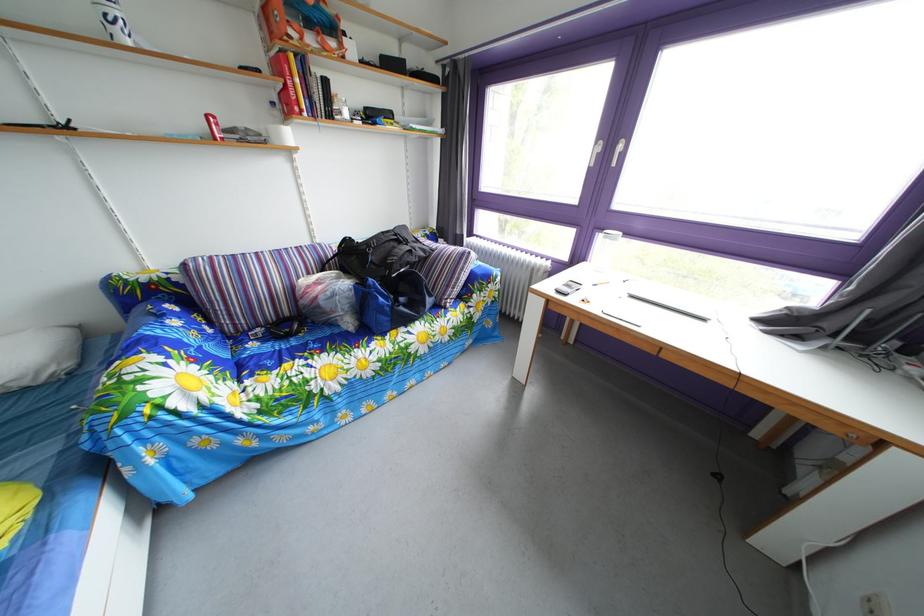
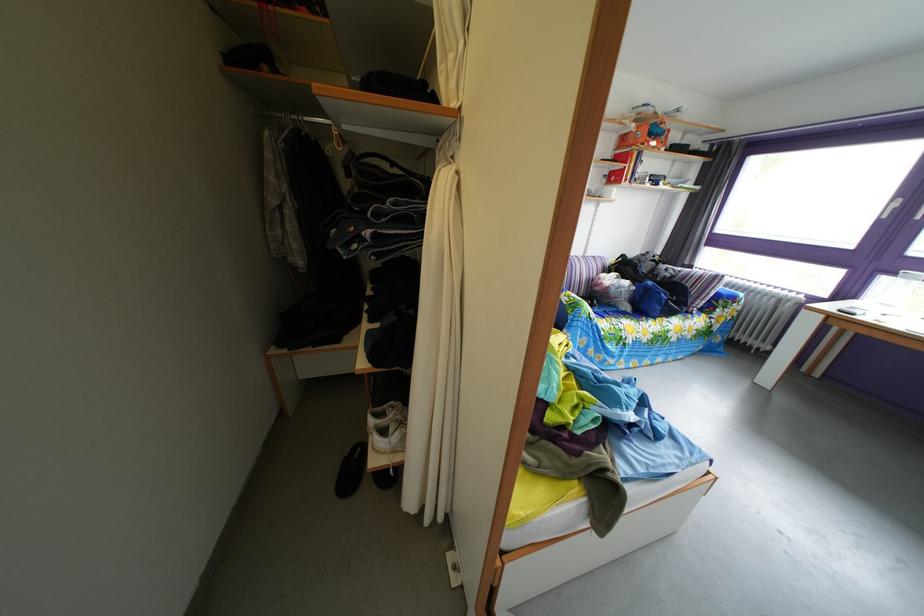
Where in the second image is the point corresponding to (323,246) from the first image?

(596, 261)